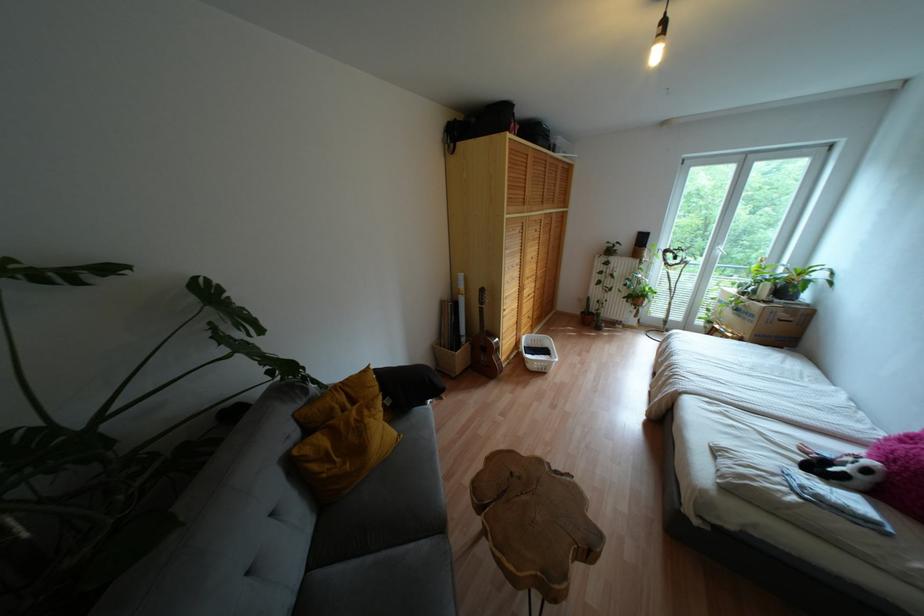
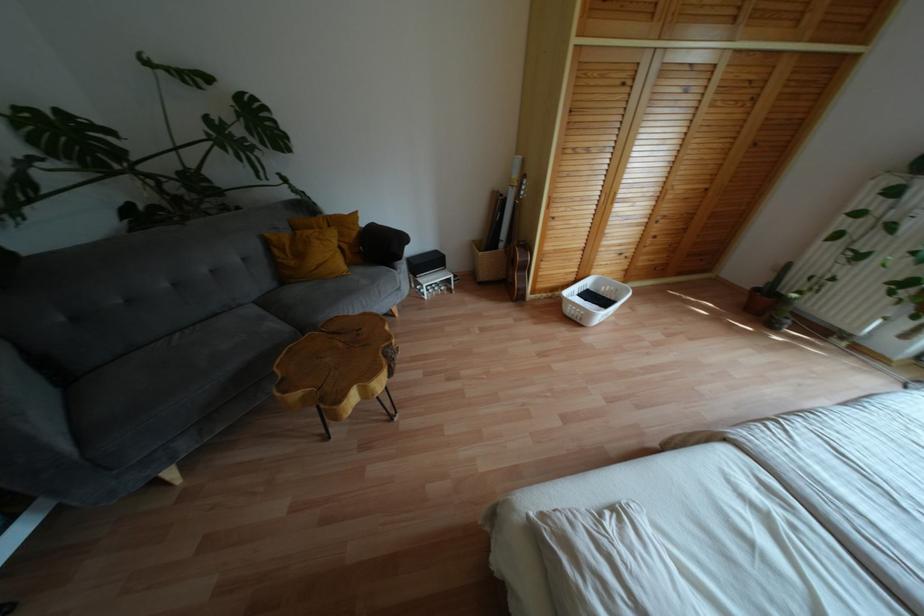
In the second image, find the point that corresponds to pixel 540 370 in the first image.

(573, 318)